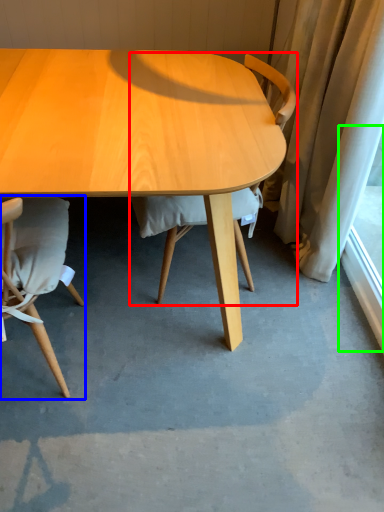
Question: Which is nearer to the chair (highlighted by a red box)? chair (highlighted by a blue box) or window screen (highlighted by a green box).

Choices:
 (A) chair
 (B) window screen

Answer: (A)